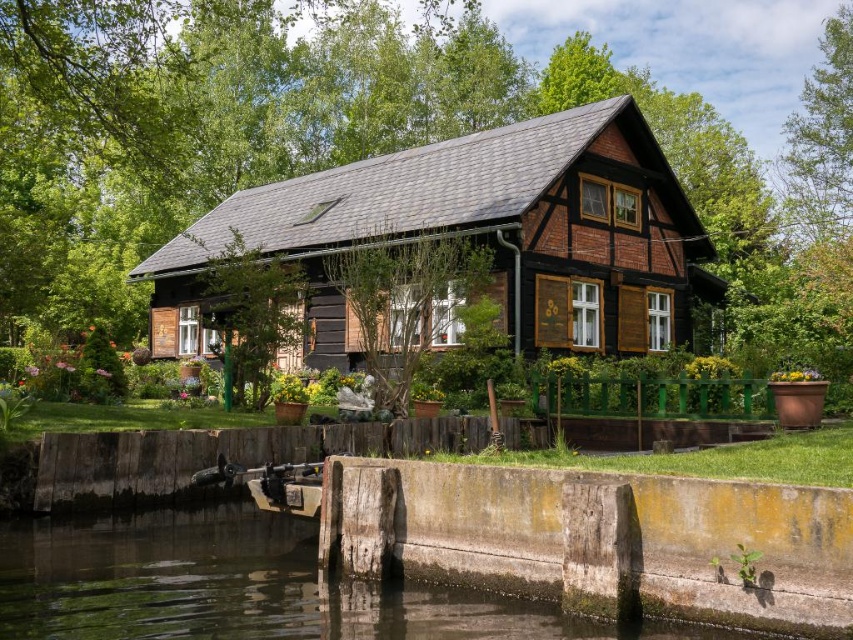
Question: Estimate the real-world distances between objects in this image. Which object is closer to the smooth concrete wall at lower center?

Choices:
 (A) green leafy tree at upper right
 (B) black wooden cabin at center

Answer: (B)

Question: From the image, what is the correct spatial relationship of black wooden cabin at center in relation to smooth concrete wall at lower center?

Choices:
 (A) below
 (B) above

Answer: (B)

Question: Which object is the closest to the smooth concrete wall at lower center?

Choices:
 (A) green leafy tree at upper right
 (B) black wooden cabin at center

Answer: (B)

Question: Can you confirm if black wooden cabin at center is thinner than smooth concrete wall at lower center?

Choices:
 (A) yes
 (B) no

Answer: (B)

Question: Among these points, which one is farthest from the camera?

Choices:
 (A) (387, 584)
 (B) (592, 257)
 (C) (845, 211)

Answer: (C)

Question: Does black wooden cabin at center have a smaller size compared to green leafy tree at upper right?

Choices:
 (A) no
 (B) yes

Answer: (B)